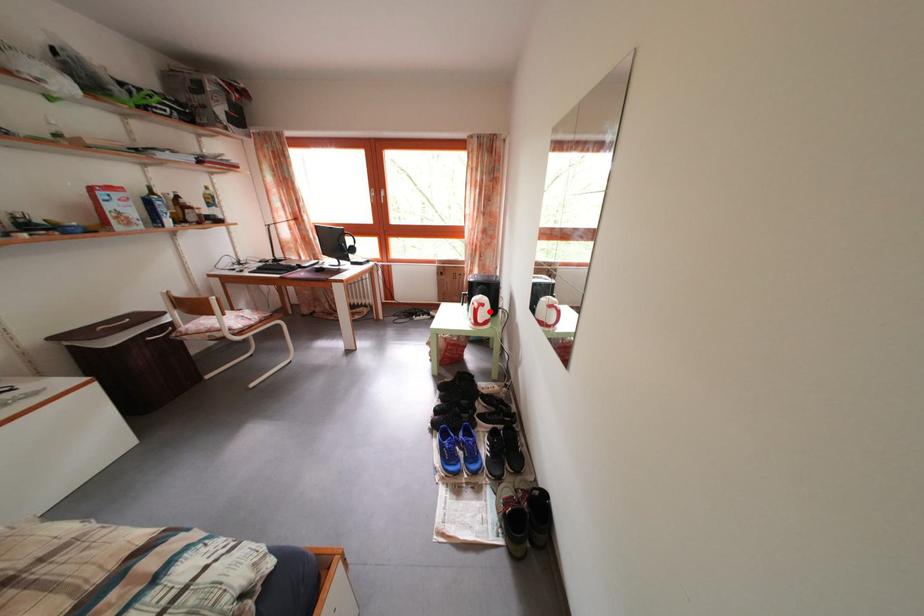
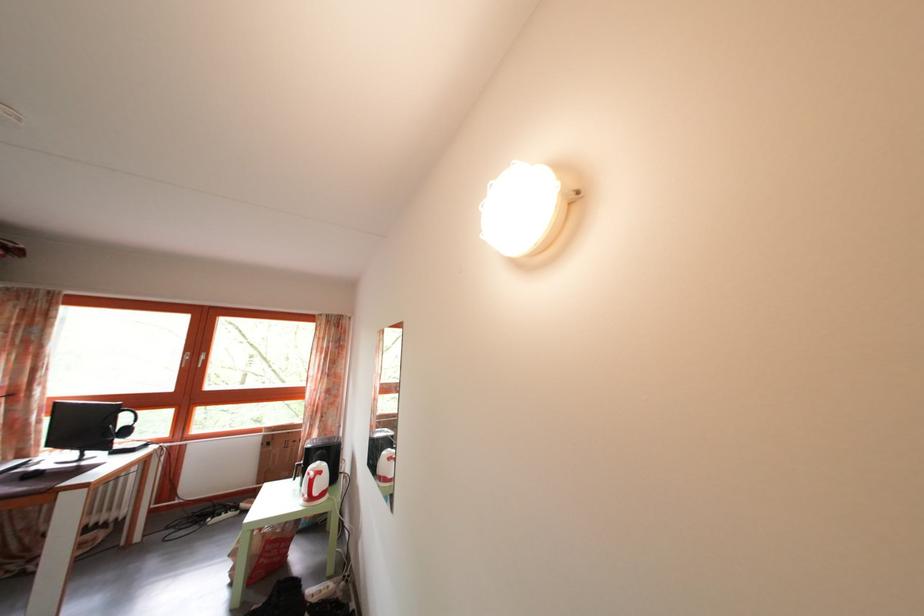
Question: I am providing you with two images of the same scene from different viewpoints. Given a red point in image1, look at the same physical point in image2. Is it:

Choices:
 (A) Closer to the viewpoint
 (B) Farther from the viewpoint

Answer: (A)